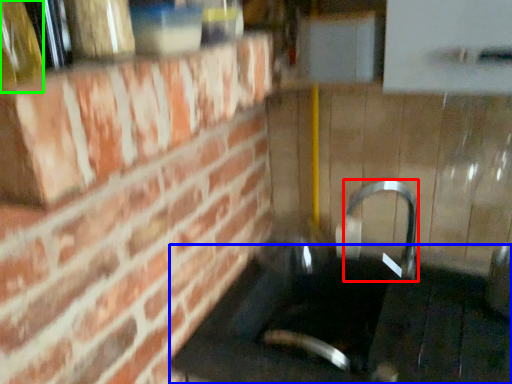
Question: Estimate the real-world distances between objects in this image. Which object is farther from faucet (highlighted by a red box), counter top (highlighted by a blue box) or bottle (highlighted by a green box)?

Choices:
 (A) counter top
 (B) bottle

Answer: (B)